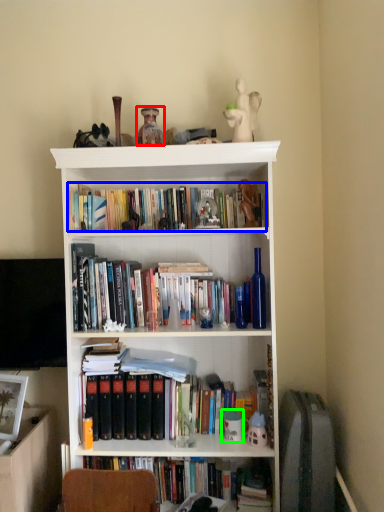
Question: Which object is the farthest from toy (highlighted by a red box)? Choose among these: book (highlighted by a blue box) or toy (highlighted by a green box).

Choices:
 (A) book
 (B) toy

Answer: (B)